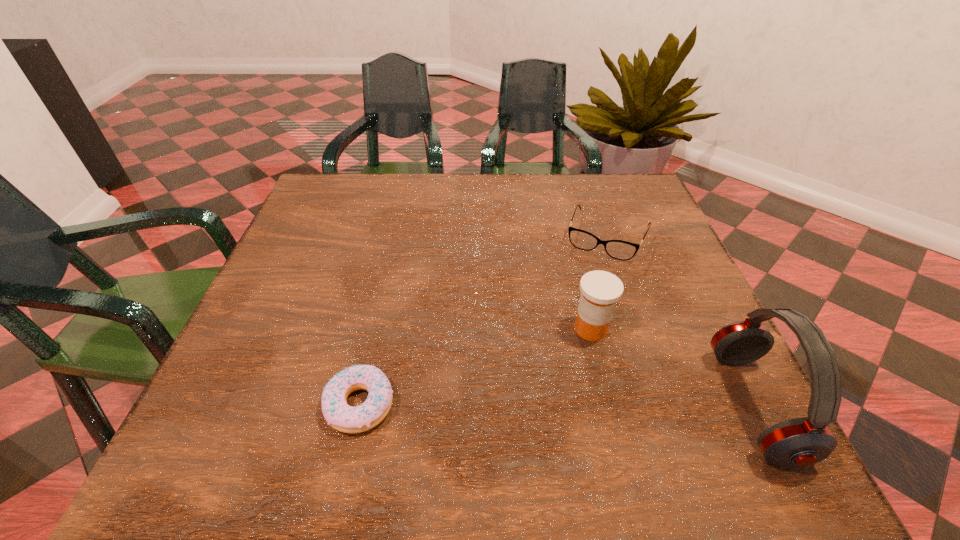
I want to click on free region located 0.170m on the front-facing side of the farthest object, so click(575, 311).

What are the coordinates of `free space located on the front-facing side of the farthest object` in the screenshot? It's located at (541, 392).

Locate an element on the screen. This screenshot has width=960, height=540. vacant position located on the front-facing side of the farthest object is located at coordinates point(541,392).

The width and height of the screenshot is (960, 540). What are the coordinates of `free space located 0.140m on the label of the third nearest object` in the screenshot? It's located at (551, 395).

Where is `free space located on the label of the third nearest object`? The height and width of the screenshot is (540, 960). free space located on the label of the third nearest object is located at coordinates (548, 400).

Where is `vacant space located 0.120m on the label of the third nearest object`? The height and width of the screenshot is (540, 960). vacant space located 0.120m on the label of the third nearest object is located at coordinates (556, 387).

Image resolution: width=960 pixels, height=540 pixels. Find the location of `object located at the far edge`. object located at the far edge is located at coordinates (618, 249).

At what (x,y) coordinates should I click in order to perform the action: click on doughnut that is at the near edge. Please return your answer as a coordinate pair (x, y). The height and width of the screenshot is (540, 960). Looking at the image, I should click on (338, 414).

Where is `earphone that is at the near edge`? The image size is (960, 540). earphone that is at the near edge is located at coordinates pyautogui.click(x=799, y=442).

Identify the location of earphone located in the right edge section of the desktop. This screenshot has height=540, width=960. (799, 442).